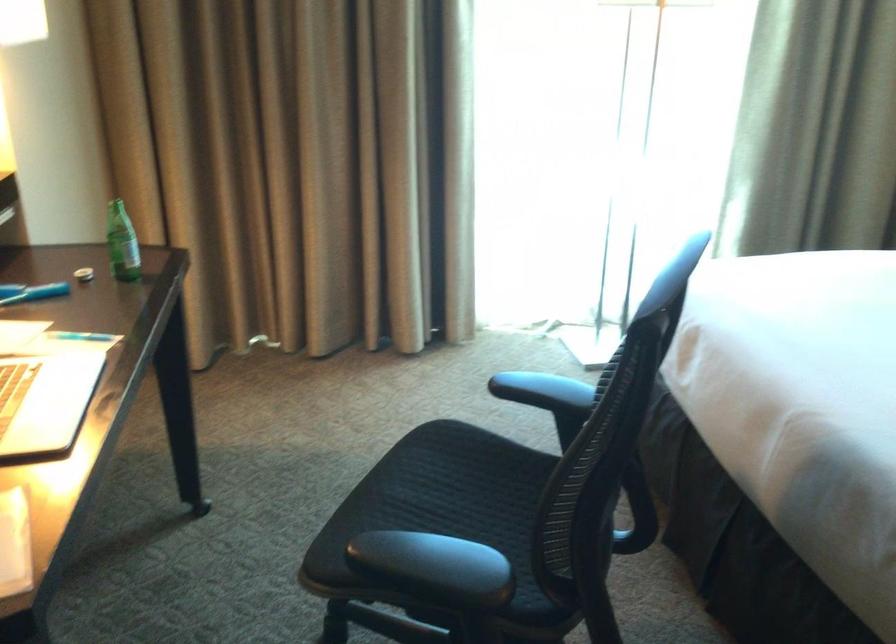
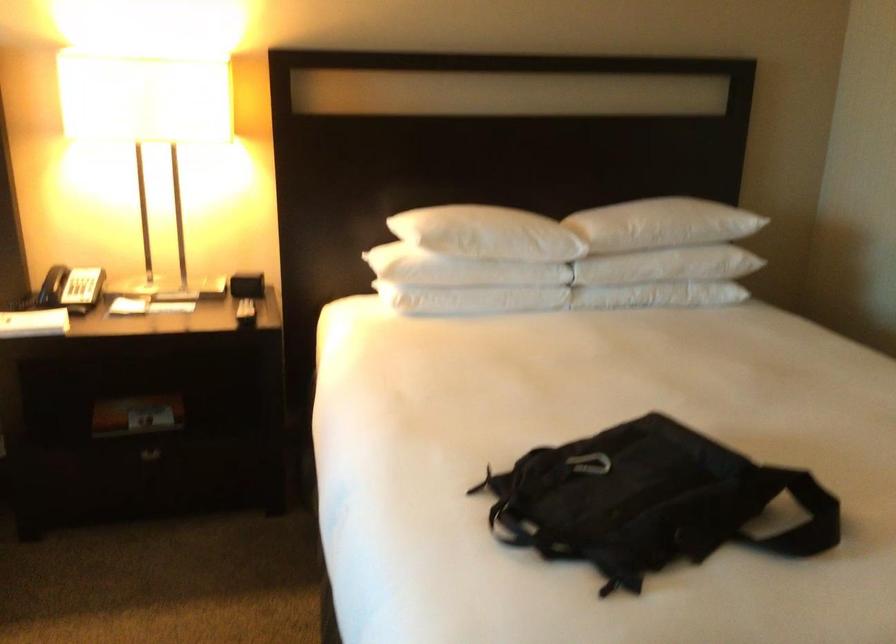
Question: The camera is either moving clockwise (left) or counter-clockwise (right) around the object. The first image is from the beginning of the video and the second image is from the end. Is the camera moving left or right when shooting the video?

Choices:
 (A) Left
 (B) Right

Answer: (A)